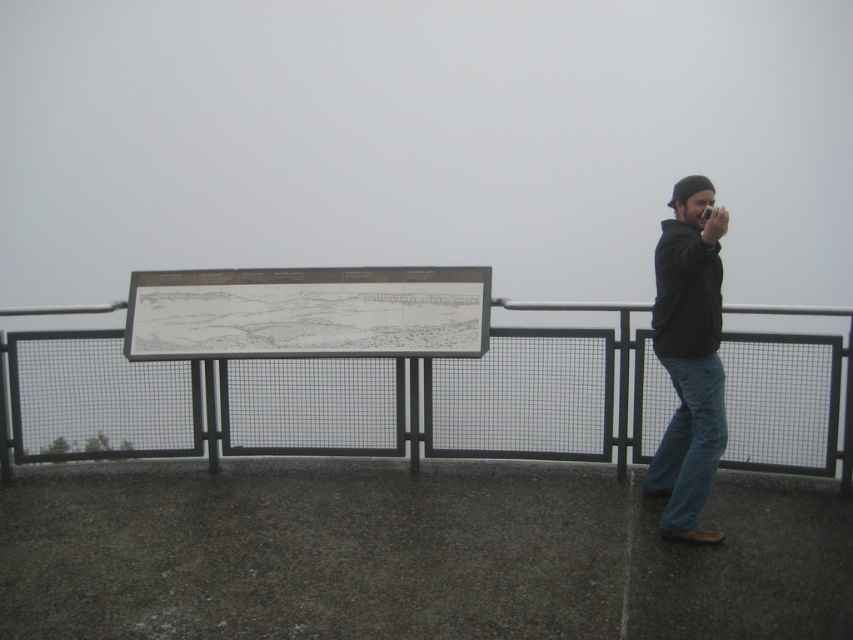
You are standing on the observation platform and want to take a photo of the metal mesh fence at center and the black matte jacket at right. Which object should you focus on first if you want to capture both in a single frame without moving the camera?

The metal mesh fence at center has a larger size compared to the black matte jacket at right, so you should focus on the metal mesh fence at center first to ensure it fits properly in the frame before adjusting for the smaller black matte jacket at right.

You are standing on the concrete platform at the viewpoint and want to take a photo of the metal mesh fence at center. According to the scene description, where exactly is the metal mesh fence positioned relative to your location?

The metal mesh fence at center is located at point 0.625 on the x axis and 0.401 on the y axis relative to your position on the concrete platform.

You are standing at the center of the platform and want to take a photo of the black matte jacket at right. Where should you position yourself to capture the jacket in the frame?

The black matte jacket at right is located at point (689, 356), so you should position yourself facing that coordinate to capture it in the frame.